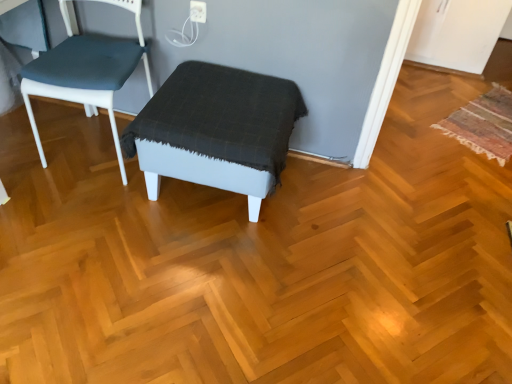
Question: Is multicolored woven mat at right aimed at matte blue fabric chair at left?

Choices:
 (A) no
 (B) yes

Answer: (A)

Question: Is multicolored woven mat at right with matte blue fabric chair at left?

Choices:
 (A) yes
 (B) no

Answer: (B)

Question: Is multicolored woven mat at right located outside matte blue fabric chair at left?

Choices:
 (A) yes
 (B) no

Answer: (A)

Question: Is multicolored woven mat at right positioned before matte blue fabric chair at left?

Choices:
 (A) no
 (B) yes

Answer: (A)

Question: Is multicolored woven mat at right facing away from matte blue fabric chair at left?

Choices:
 (A) no
 (B) yes

Answer: (A)

Question: From a real-world perspective, is multicolored woven mat at right located higher than matte blue fabric chair at left?

Choices:
 (A) yes
 (B) no

Answer: (B)

Question: Would you say matte gray stool at center contains matte blue fabric chair at left?

Choices:
 (A) yes
 (B) no

Answer: (B)

Question: Is matte gray stool at center outside matte blue fabric chair at left?

Choices:
 (A) yes
 (B) no

Answer: (A)

Question: Is matte gray stool at center positioned far away from matte blue fabric chair at left?

Choices:
 (A) no
 (B) yes

Answer: (A)

Question: From the image's perspective, is matte gray stool at center beneath matte blue fabric chair at left?

Choices:
 (A) no
 (B) yes

Answer: (B)

Question: Is matte gray stool at center placed right next to matte blue fabric chair at left?

Choices:
 (A) yes
 (B) no

Answer: (B)

Question: Is matte gray stool at center at the left side of matte blue fabric chair at left?

Choices:
 (A) no
 (B) yes

Answer: (A)

Question: From the image's perspective, is multicolored woven mat at right located beneath matte gray stool at center?

Choices:
 (A) no
 (B) yes

Answer: (A)